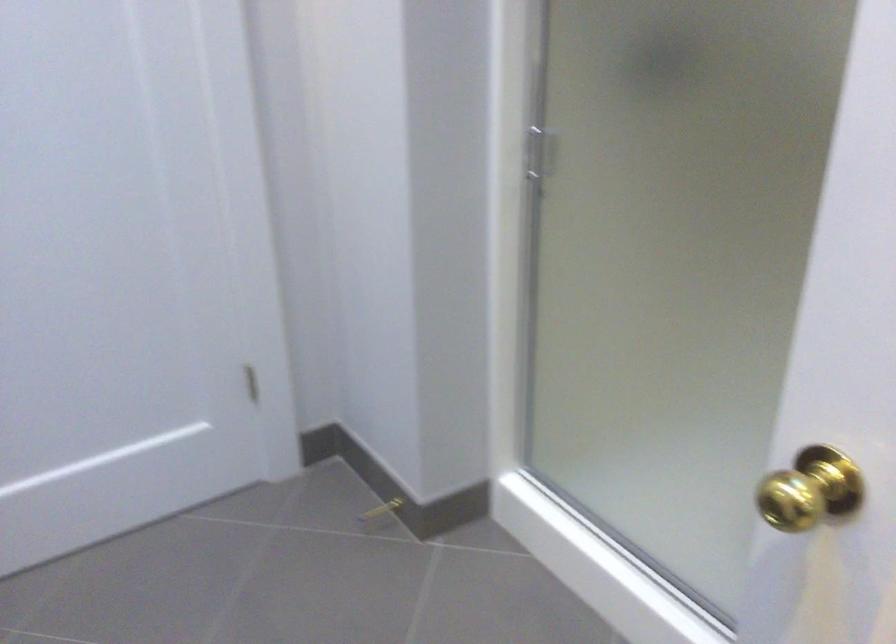
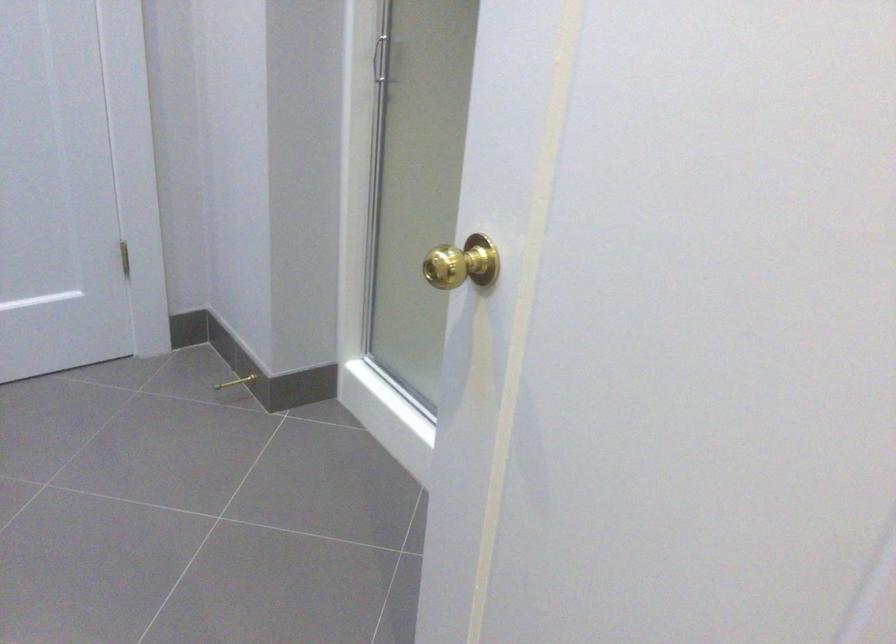
Question: How did the camera likely rotate?

Choices:
 (A) Left
 (B) Right
 (C) Up
 (D) Down

Answer: (B)